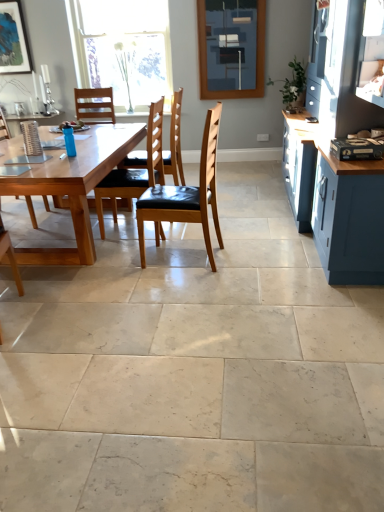
Locate an element on the screen. spots to the right of brown leather chair at center, placed as the fourth chair when sorted from left to right is located at coordinates (241, 257).